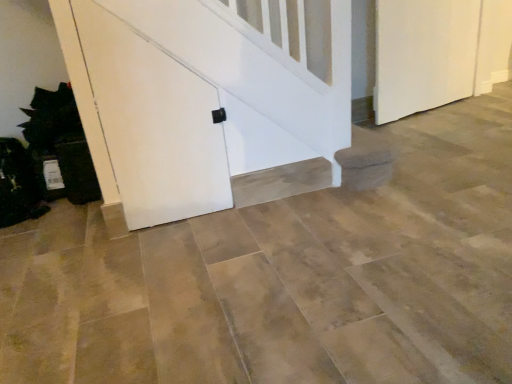
Question: Do you think white matte door at right, which is counted as the 2th door, starting from the left, is within white matte door at center, arranged as the 1th door when viewed from the front, or outside of it?

Choices:
 (A) inside
 (B) outside

Answer: (B)

Question: Considering the positions of white matte door at right, which is counted as the 2th door, starting from the left, and white matte door at center, placed as the 2th door when sorted from right to left, in the image, is white matte door at right, which is counted as the 2th door, starting from the left, wider or thinner than white matte door at center, placed as the 2th door when sorted from right to left,?

Choices:
 (A) wide
 (B) thin

Answer: (A)

Question: Considering the positions of point (429, 105) and point (137, 18), is point (429, 105) closer or farther from the camera than point (137, 18)?

Choices:
 (A) closer
 (B) farther

Answer: (B)

Question: Is point (69, 64) positioned closer to the camera than point (466, 76)?

Choices:
 (A) closer
 (B) farther

Answer: (A)

Question: Considering the positions of white matte door at center, arranged as the 1th door when viewed from the left, and white matte door at right, the 1th door viewed from the right, in the image, is white matte door at center, arranged as the 1th door when viewed from the left, taller or shorter than white matte door at right, the 1th door viewed from the right,?

Choices:
 (A) tall
 (B) short

Answer: (A)

Question: From the image's perspective, is white matte door at center, acting as the 2th door starting from the back, located above or below white matte door at right, which is counted as the 2th door, starting from the left?

Choices:
 (A) below
 (B) above

Answer: (A)

Question: Considering the positions of white matte door at center, placed as the 2th door when sorted from right to left, and white matte door at right, the first door positioned from the back, in the image, is white matte door at center, placed as the 2th door when sorted from right to left, wider or thinner than white matte door at right, the first door positioned from the back,?

Choices:
 (A) thin
 (B) wide

Answer: (A)